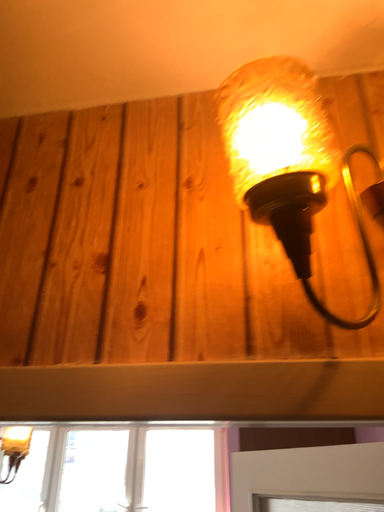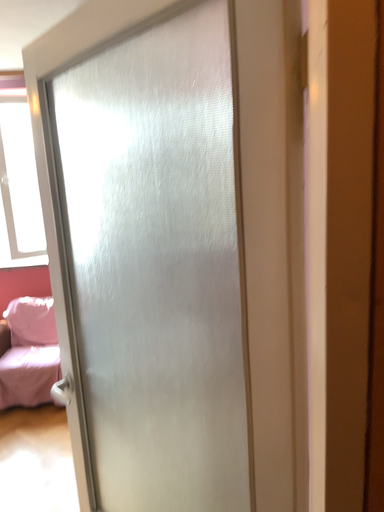
Question: Which way did the camera rotate in the video?

Choices:
 (A) rotated right
 (B) rotated left

Answer: (A)